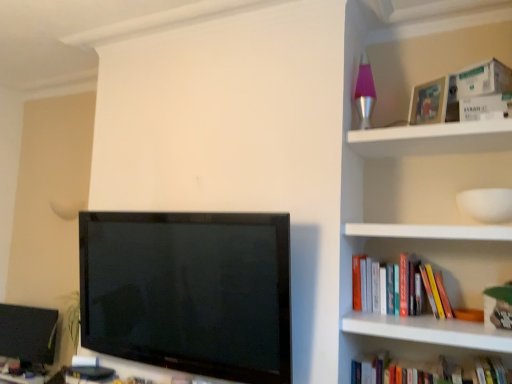
Locate an element on the screen. matte black monitor at lower left is located at coordinates (28, 333).

Find the location of a particular element. This screenshot has height=384, width=512. hardcover book at right, the second book ordered from the bottom is located at coordinates (435, 291).

From the picture: Looking at their sizes, would you say matte black monitor at lower left is wider or thinner than hardcover book at right, which is counted as the 1th book, starting from the top?

Clearly, matte black monitor at lower left has less width compared to hardcover book at right, which is counted as the 1th book, starting from the top.

From the image's perspective, which one is positioned lower, matte black monitor at lower left or hardcover book at right, which is counted as the 1th book, starting from the top?

matte black monitor at lower left appears lower in the image.

Can you tell me how much matte black monitor at lower left and hardcover book at right, the second book ordered from the bottom, differ in facing direction?

The angle between the facing direction of matte black monitor at lower left and the facing direction of hardcover book at right, the second book ordered from the bottom, is 2.58 degrees.

From a real-world perspective, is matte black monitor at lower left on top of hardcover book at right, the second book ordered from the bottom?

Incorrect, from a real-world perspective, matte black monitor at lower left is lower than hardcover book at right, the second book ordered from the bottom.

How different are the orientations of white cardboard box at upper right, which is counted as the second paperback book, starting from the bottom, and hardcover book at lower right, the 2th book viewed from the top, in degrees?

The facing directions of white cardboard box at upper right, which is counted as the second paperback book, starting from the bottom, and hardcover book at lower right, the 2th book viewed from the top, are 25.7 degrees apart.

Considering the sizes of objects white cardboard box at upper right, marked as the first paperback book in a top-to-bottom arrangement, and hardcover book at lower right, which is counted as the first book, starting from the bottom, in the image provided, who is smaller, white cardboard box at upper right, marked as the first paperback book in a top-to-bottom arrangement, or hardcover book at lower right, which is counted as the first book, starting from the bottom,?

Smaller between the two is white cardboard box at upper right, marked as the first paperback book in a top-to-bottom arrangement.

Which object is further away from the camera, white cardboard box at upper right, marked as the first paperback book in a top-to-bottom arrangement, or hardcover book at lower right, the 2th book viewed from the top?

white cardboard box at upper right, marked as the first paperback book in a top-to-bottom arrangement, is further from the camera.

In the scene shown: In terms of width, does white cardboard box at upper right, which is counted as the second paperback book, starting from the bottom, look wider or thinner when compared to hardcover book at lower right, the 2th book viewed from the top?

In the image, white cardboard box at upper right, which is counted as the second paperback book, starting from the bottom, appears to be more narrow than hardcover book at lower right, the 2th book viewed from the top.

Considering the sizes of objects hardcover book at lower right, the 2th book viewed from the top, and matte black monitor at lower left in the image provided, who is thinner, hardcover book at lower right, the 2th book viewed from the top, or matte black monitor at lower left?

matte black monitor at lower left is thinner.

Would you say matte black monitor at lower left is part of hardcover book at lower right, the 2th book viewed from the top,'s contents?

No, matte black monitor at lower left is not surrounded by hardcover book at lower right, the 2th book viewed from the top.

From a real-world perspective, which is physically below, hardcover book at lower right, the 2th book viewed from the top, or matte black monitor at lower left?

matte black monitor at lower left.

In terms of height, does white cardboard box at upper right, which is counted as the second paperback book, starting from the bottom, look taller or shorter compared to matte black monitor at lower left?

Clearly, white cardboard box at upper right, which is counted as the second paperback book, starting from the bottom, is shorter compared to matte black monitor at lower left.

Is point (483, 93) behind point (17, 327)?

No, it is in front of (17, 327).

Is white cardboard box at upper right, which is counted as the second paperback book, starting from the bottom, positioned before matte black monitor at lower left?

Yes, the depth of white cardboard box at upper right, which is counted as the second paperback book, starting from the bottom, is less than that of matte black monitor at lower left.

Looking at this image, is matte black monitor at lower left a part of white cardboard box at upper right, which is counted as the second paperback book, starting from the bottom?

Actually, matte black monitor at lower left is outside white cardboard box at upper right, which is counted as the second paperback book, starting from the bottom.

Which point is more forward, (509,97) or (472,103)?

The point (509,97) is more forward.

Is white cardboard box at upper right, which is counted as the second paperback book, starting from the bottom, not close to white cardboard box at upper right, the first paperback book positioned from the bottom?

No, white cardboard box at upper right, which is counted as the second paperback book, starting from the bottom, is not far from white cardboard box at upper right, the first paperback book positioned from the bottom.

Which is behind, white cardboard box at upper right, marked as the first paperback book in a top-to-bottom arrangement, or white cardboard box at upper right, the first paperback book positioned from the bottom?

white cardboard box at upper right, marked as the first paperback book in a top-to-bottom arrangement, is further away from the camera.

From the image's perspective, is white cardboard box at upper right, marked as the first paperback book in a top-to-bottom arrangement, positioned above or below white cardboard box at upper right, the 2th paperback book positioned from the top?

Based on their image positions, white cardboard box at upper right, marked as the first paperback book in a top-to-bottom arrangement, is located above white cardboard box at upper right, the 2th paperback book positioned from the top.

From the image's perspective, which paperback book is the 1st one above the hardcover book at right, the second book ordered from the bottom? Please provide its 2D coordinates.

[(485, 107)]

Which is more to the left, white cardboard box at upper right, the 2th paperback book positioned from the top, or hardcover book at right, which is counted as the 1th book, starting from the top?

From the viewer's perspective, hardcover book at right, which is counted as the 1th book, starting from the top, appears more on the left side.

Is hardcover book at right, which is counted as the 1th book, starting from the top, at the back of white cardboard box at upper right, the first paperback book positioned from the bottom?

No.

Which is nearer, (473, 118) or (407, 271)?

Point (473, 118) appears to be closer to the viewer than point (407, 271).

From a real-world perspective, who is located higher, hardcover book at right, the second book ordered from the bottom, or white cardboard box at upper right, marked as the first paperback book in a top-to-bottom arrangement?

In real-world perspective, white cardboard box at upper right, marked as the first paperback book in a top-to-bottom arrangement, is above.

Locate an element on the screen. the 1st paperback book to the right when counting from the hardcover book at right, which is counted as the 1th book, starting from the top is located at coordinates (478, 90).

In the image, is hardcover book at right, which is counted as the 1th book, starting from the top, positioned in front of or behind white cardboard box at upper right, marked as the first paperback book in a top-to-bottom arrangement?

Clearly, hardcover book at right, which is counted as the 1th book, starting from the top, is behind white cardboard box at upper right, marked as the first paperback book in a top-to-bottom arrangement.

Based on the photo, is hardcover book at right, the second book ordered from the bottom, positioned with its back to white cardboard box at upper right, marked as the first paperback book in a top-to-bottom arrangement?

No.

The image size is (512, 384). In order to click on the 1st book to the right when counting from the matte black monitor at lower left in this screenshot , I will do `click(435, 291)`.

Find the location of a particular element. This screenshot has width=512, height=384. the 2nd paperback book behind when counting from the hardcover book at lower right, which is counted as the first book, starting from the bottom is located at coordinates (478, 90).

Looking at the image, which one is located further to matte black monitor at lower left, hardcover book at lower right, the 2th book viewed from the top, or white cardboard box at upper right, marked as the first paperback book in a top-to-bottom arrangement?

white cardboard box at upper right, marked as the first paperback book in a top-to-bottom arrangement, lies further to matte black monitor at lower left than the other object.

Based on their spatial positions, is white cardboard box at upper right, the first paperback book positioned from the bottom, or hardcover book at lower right, the 2th book viewed from the top, closer to matte black monitor at lower left?

hardcover book at lower right, the 2th book viewed from the top, is positioned closer to the anchor matte black monitor at lower left.

Estimate the real-world distances between objects in this image. Which object is further from white cardboard box at upper right, which is counted as the second paperback book, starting from the bottom, white cardboard box at upper right, the first paperback book positioned from the bottom, or matte black monitor at lower left?

matte black monitor at lower left is further to white cardboard box at upper right, which is counted as the second paperback book, starting from the bottom.

From the image, which object appears to be farther from hardcover book at right, the second book ordered from the bottom, white cardboard box at upper right, marked as the first paperback book in a top-to-bottom arrangement, or matte black monitor at lower left?

matte black monitor at lower left is further to hardcover book at right, the second book ordered from the bottom.

Which object lies nearer to the anchor point white cardboard box at upper right, the first paperback book positioned from the bottom, hardcover book at right, the second book ordered from the bottom, or matte black monitor at lower left?

Based on the image, hardcover book at right, the second book ordered from the bottom, appears to be nearer to white cardboard box at upper right, the first paperback book positioned from the bottom.

Which object lies nearer to the anchor point white cardboard box at upper right, which is counted as the second paperback book, starting from the bottom, white cardboard box at upper right, the 2th paperback book positioned from the top, or hardcover book at right, which is counted as the 1th book, starting from the top?

white cardboard box at upper right, the 2th paperback book positioned from the top.

Estimate the real-world distances between objects in this image. Which object is further from hardcover book at lower right, which is counted as the first book, starting from the bottom, white cardboard box at upper right, the 2th paperback book positioned from the top, or hardcover book at right, the second book ordered from the bottom?

Among the two, white cardboard box at upper right, the 2th paperback book positioned from the top, is located further to hardcover book at lower right, which is counted as the first book, starting from the bottom.

Based on their spatial positions, is white cardboard box at upper right, marked as the first paperback book in a top-to-bottom arrangement, or white cardboard box at upper right, the first paperback book positioned from the bottom, closer to matte black monitor at lower left?

white cardboard box at upper right, marked as the first paperback book in a top-to-bottom arrangement, lies closer to matte black monitor at lower left than the other object.

Locate an element on the screen. The width and height of the screenshot is (512, 384). book between white cardboard box at upper right, the 2th paperback book positioned from the top, and hardcover book at lower right, the 2th book viewed from the top, vertically is located at coordinates (435, 291).

Identify the location of paperback book between white cardboard box at upper right, marked as the first paperback book in a top-to-bottom arrangement, and hardcover book at lower right, which is counted as the first book, starting from the bottom, in the vertical direction. The height and width of the screenshot is (384, 512). (485, 107).

What are the coordinates of `paperback book between white cardboard box at upper right, marked as the first paperback book in a top-to-bottom arrangement, and hardcover book at right, the second book ordered from the bottom, in the vertical direction` in the screenshot? It's located at (485, 107).

At what (x,y) coordinates should I click in order to perform the action: click on book between matte black monitor at lower left and hardcover book at lower right, the 2th book viewed from the top, from left to right. Please return your answer as a coordinate pair (x, y). The height and width of the screenshot is (384, 512). Looking at the image, I should click on (435, 291).